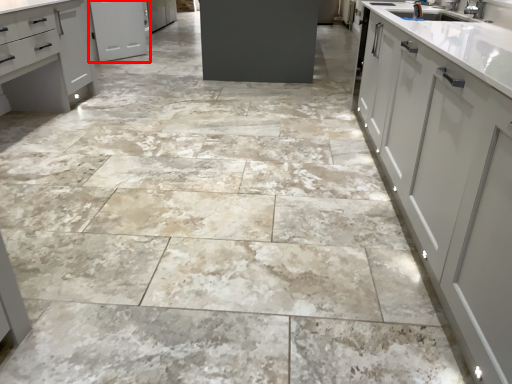
Question: Where is cabinetry (annotated by the red box) located in relation to cabinetry in the image?

Choices:
 (A) left
 (B) right

Answer: (B)